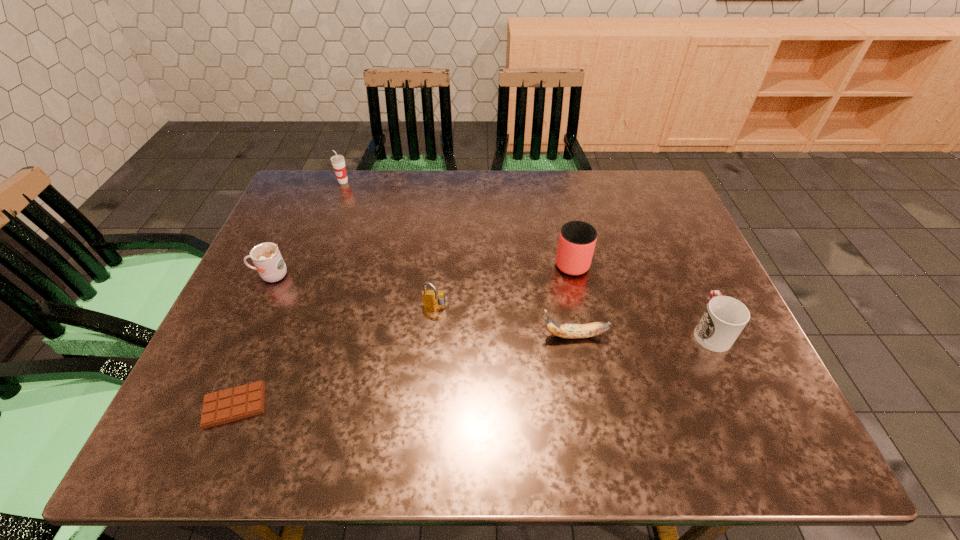
Where is `free location located 0.170m at the stem of the banana`? The height and width of the screenshot is (540, 960). free location located 0.170m at the stem of the banana is located at coordinates (466, 336).

This screenshot has height=540, width=960. Find the location of `vacant area situated 0.120m on the back of the shortest object`. vacant area situated 0.120m on the back of the shortest object is located at coordinates (264, 336).

Where is `object that is at the far edge`? object that is at the far edge is located at coordinates [x=338, y=162].

Identify the location of object present at the near edge. (244, 401).

The image size is (960, 540). Identify the location of candy bar at the left edge. (244, 401).

Find the location of `object that is at the right edge`. object that is at the right edge is located at coordinates (724, 318).

The height and width of the screenshot is (540, 960). I want to click on object located in the far left corner section of the desktop, so click(338, 162).

Identify the location of object that is at the near left corner. (244, 401).

In the image, there is a desktop. Where is `vacant space at the far edge`? vacant space at the far edge is located at coordinates (420, 201).

In the image, there is a desktop. At what (x,y) coordinates should I click in order to perform the action: click on free space at the near edge. Please return your answer as a coordinate pair (x, y). The image size is (960, 540). Looking at the image, I should click on (540, 435).